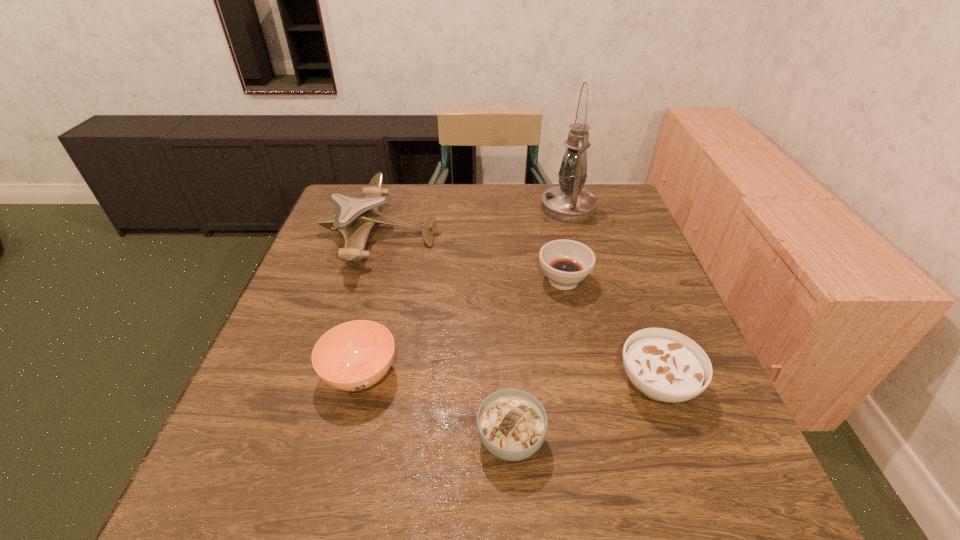
In the image, there is a desktop. In order to click on vacant space at the near edge in this screenshot , I will do `click(591, 513)`.

In the image, there is a desktop. Find the location of `vacant space at the left edge`. vacant space at the left edge is located at coordinates (239, 443).

I want to click on vacant area at the right edge of the desktop, so click(x=637, y=242).

Locate an element on the screen. The height and width of the screenshot is (540, 960). vacant space at the far left corner is located at coordinates (379, 207).

Find the location of `vacant space at the near left corner`. vacant space at the near left corner is located at coordinates (199, 512).

The width and height of the screenshot is (960, 540). In the image, there is a desktop. What are the coordinates of `free space at the far right corner` in the screenshot? It's located at (622, 223).

Where is `free space between the leftmost soup bowl and the fourth object from right to left`? This screenshot has width=960, height=540. free space between the leftmost soup bowl and the fourth object from right to left is located at coordinates (436, 407).

This screenshot has width=960, height=540. In order to click on blank region between the fourth object from right to left and the leftmost soup bowl in this screenshot , I will do `click(436, 407)`.

Where is `vacant point located between the farthest soup bowl and the leftmost soup bowl`? This screenshot has width=960, height=540. vacant point located between the farthest soup bowl and the leftmost soup bowl is located at coordinates (462, 327).

Find the location of a particular element. The height and width of the screenshot is (540, 960). empty location between the second soup bowl from left to right and the drone is located at coordinates (445, 336).